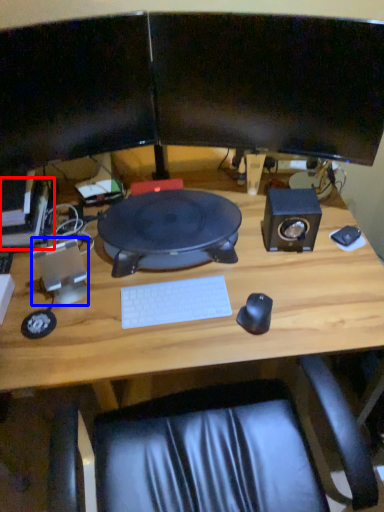
Question: Which of the following is the farthest to the observer, computer (highlighted by a red box) or speaker (highlighted by a blue box)?

Choices:
 (A) computer
 (B) speaker

Answer: (A)